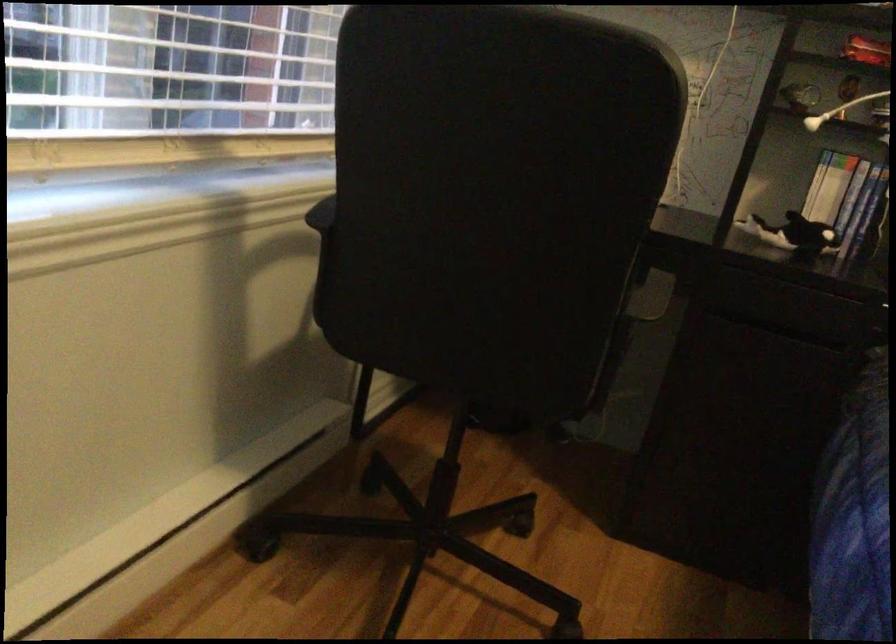
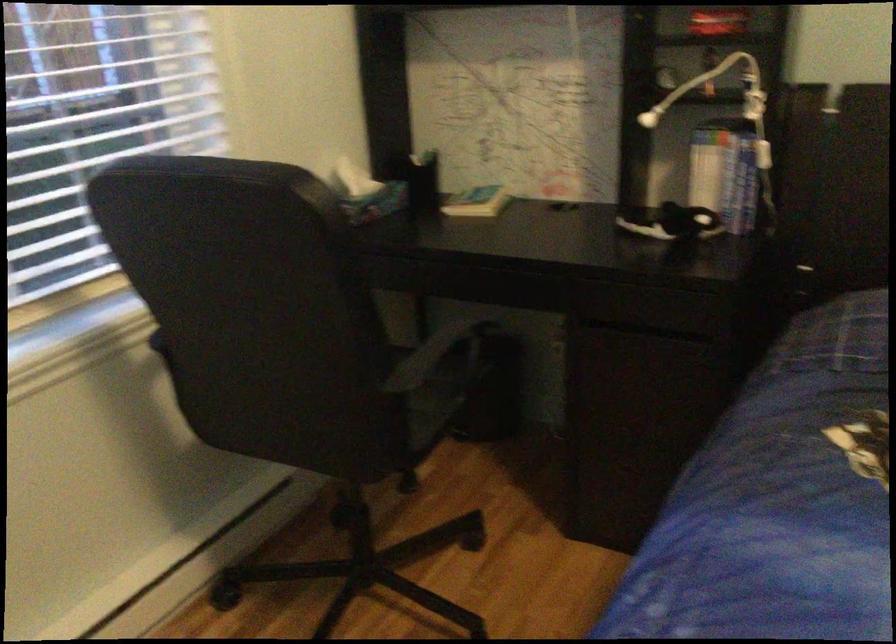
Question: How did the camera likely rotate?

Choices:
 (A) Left
 (B) Right
 (C) Up
 (D) Down

Answer: (A)